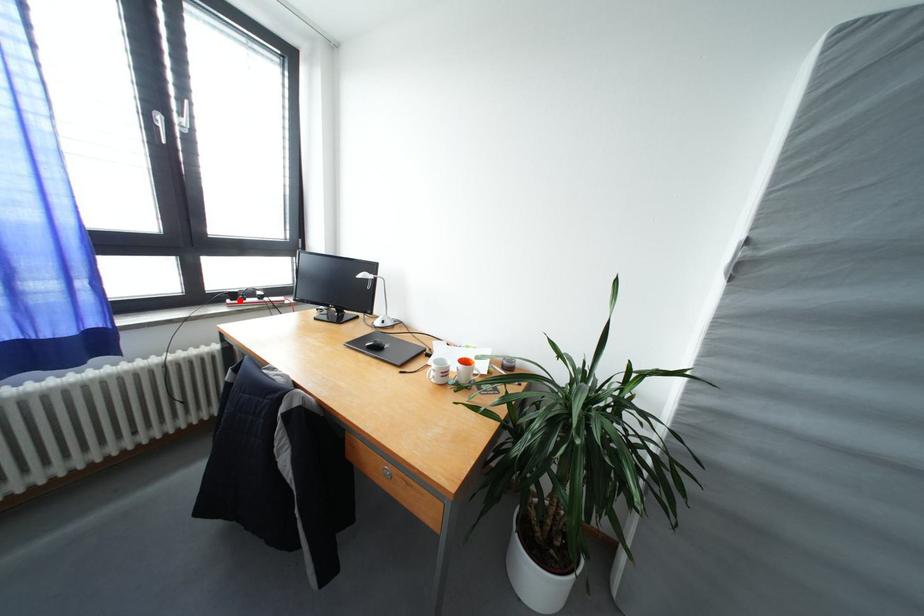
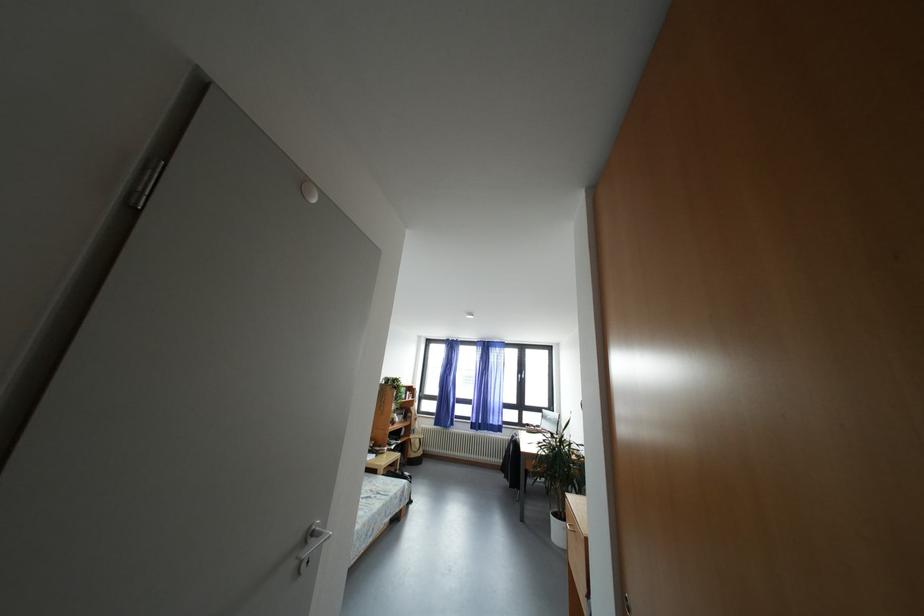
Locate, in the second image, the point that corresponds to the highlighted location in the first image.

(533, 430)